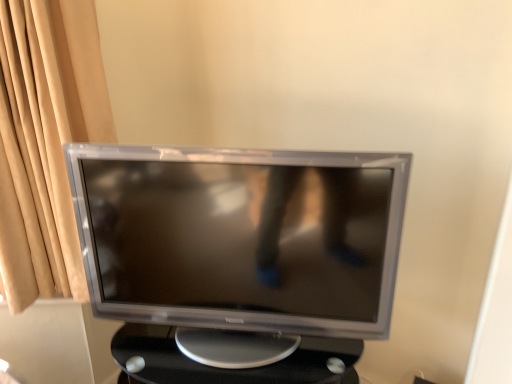
Where is `satin silver monitor at center`? satin silver monitor at center is located at coordinates (240, 243).

The width and height of the screenshot is (512, 384). What do you see at coordinates (240, 243) in the screenshot?
I see `satin silver monitor at center` at bounding box center [240, 243].

Identify the location of black plastic table at center. (229, 369).

What do you see at coordinates (229, 369) in the screenshot? I see `black plastic table at center` at bounding box center [229, 369].

Identify the location of satin silver monitor at center. click(240, 243).

Which is more to the left, black plastic table at center or satin silver monitor at center?

satin silver monitor at center.

Is black plastic table at center in front of or behind satin silver monitor at center in the image?

Visually, black plastic table at center is located behind satin silver monitor at center.

Considering the points (310, 342) and (294, 206), which point is behind, point (310, 342) or point (294, 206)?

The point (310, 342) is farther.

From the image's perspective, would you say black plastic table at center is shown under satin silver monitor at center?

Yes.

From a real-world perspective, which object stands above the other?

In real-world perspective, satin silver monitor at center is above.

Looking at their sizes, would you say black plastic table at center is wider or thinner than satin silver monitor at center?

In the image, black plastic table at center appears to be wider than satin silver monitor at center.

Is black plastic table at center shorter than satin silver monitor at center?

Yes.

Considering the relative sizes of black plastic table at center and satin silver monitor at center in the image provided, is black plastic table at center smaller than satin silver monitor at center?

No, black plastic table at center is not smaller than satin silver monitor at center.

Would you say black plastic table at center contains satin silver monitor at center?

No, satin silver monitor at center is located outside of black plastic table at center.

Is black plastic table at center positioned far away from satin silver monitor at center?

No, black plastic table at center is not far from satin silver monitor at center.

Is black plastic table at center aimed at satin silver monitor at center?

No, black plastic table at center does not turn towards satin silver monitor at center.

In order to click on table to the right of satin silver monitor at center in this screenshot , I will do `click(229, 369)`.

Considering the relative positions of satin silver monitor at center and black plastic table at center in the image provided, is satin silver monitor at center to the right of black plastic table at center from the viewer's perspective?

No.

Does satin silver monitor at center lie behind black plastic table at center?

No, it is in front of black plastic table at center.

Does point (140, 319) come behind point (319, 342)?

Yes, it is behind point (319, 342).

From the image's perspective, is satin silver monitor at center located above or below black plastic table at center?

satin silver monitor at center is above black plastic table at center.

In the scene shown: From a real-world perspective, is satin silver monitor at center above or below black plastic table at center?

Clearly, from a real-world perspective, satin silver monitor at center is above black plastic table at center.

From the picture: Considering the relative sizes of satin silver monitor at center and black plastic table at center in the image provided, is satin silver monitor at center wider than black plastic table at center?

No, satin silver monitor at center is not wider than black plastic table at center.

Can you confirm if satin silver monitor at center is taller than black plastic table at center?

Yes.

Based on their sizes in the image, would you say satin silver monitor at center is bigger or smaller than black plastic table at center?

Considering their sizes, satin silver monitor at center takes up less space than black plastic table at center.

Is satin silver monitor at center inside the boundaries of black plastic table at center, or outside?

The correct answer is: outside.

Can you see satin silver monitor at center touching black plastic table at center?

No, satin silver monitor at center is not next to black plastic table at center.

Does satin silver monitor at center turn towards black plastic table at center?

No, satin silver monitor at center does not turn towards black plastic table at center.

How different are the orientations of satin silver monitor at center and black plastic table at center in degrees?

1.93 degrees separate the facing orientations of satin silver monitor at center and black plastic table at center.

Measure the distance from satin silver monitor at center to black plastic table at center.

A distance of 10.49 inches exists between satin silver monitor at center and black plastic table at center.

Where is `table below the satin silver monitor at center (from a real-world perspective)`? The width and height of the screenshot is (512, 384). table below the satin silver monitor at center (from a real-world perspective) is located at coordinates (229, 369).

Locate an element on the screen. computer monitor above the black plastic table at center (from the image's perspective) is located at coordinates (240, 243).

In order to click on table behind the satin silver monitor at center in this screenshot , I will do `click(229, 369)`.